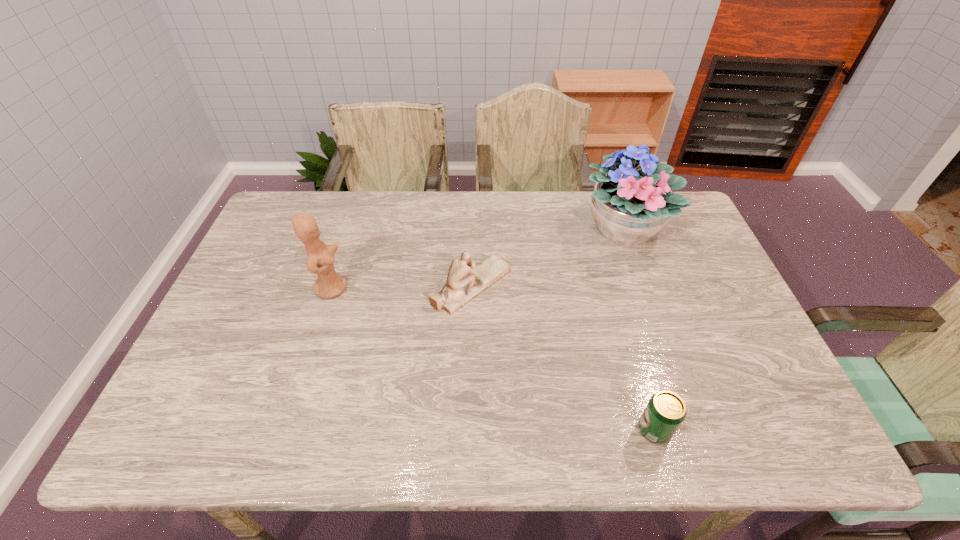
Locate an element on the screen. Image resolution: width=960 pixels, height=540 pixels. unoccupied position between the bouquet and the shortest object is located at coordinates (639, 329).

Locate an element on the screen. The image size is (960, 540). the second closest object to the shortest object is located at coordinates (630, 206).

What are the coordinates of `object that is the closest one to the bouquet` in the screenshot? It's located at (465, 281).

Locate an element on the screen. vacant space that satisfies the following two spatial constraints: 1. on the back side of the bouquet; 2. on the left side of the nearest object is located at coordinates (597, 228).

Locate an element on the screen. vacant region that satisfies the following two spatial constraints: 1. on the front-facing side of the shorter figurine; 2. on the back side of the nearest object is located at coordinates (468, 429).

Find the location of `free space that satisfies the following two spatial constraints: 1. on the front-facing side of the shorter figurine; 2. on the right side of the nearest object`. free space that satisfies the following two spatial constraints: 1. on the front-facing side of the shorter figurine; 2. on the right side of the nearest object is located at coordinates (468, 429).

The height and width of the screenshot is (540, 960). I want to click on free spot that satisfies the following two spatial constraints: 1. on the front-facing side of the beer can; 2. on the right side of the second shortest object, so click(x=468, y=429).

Where is `vacant area in the image that satisfies the following two spatial constraints: 1. on the front side of the bouquet; 2. on the front-facing side of the right figurine`? The height and width of the screenshot is (540, 960). vacant area in the image that satisfies the following two spatial constraints: 1. on the front side of the bouquet; 2. on the front-facing side of the right figurine is located at coordinates (644, 286).